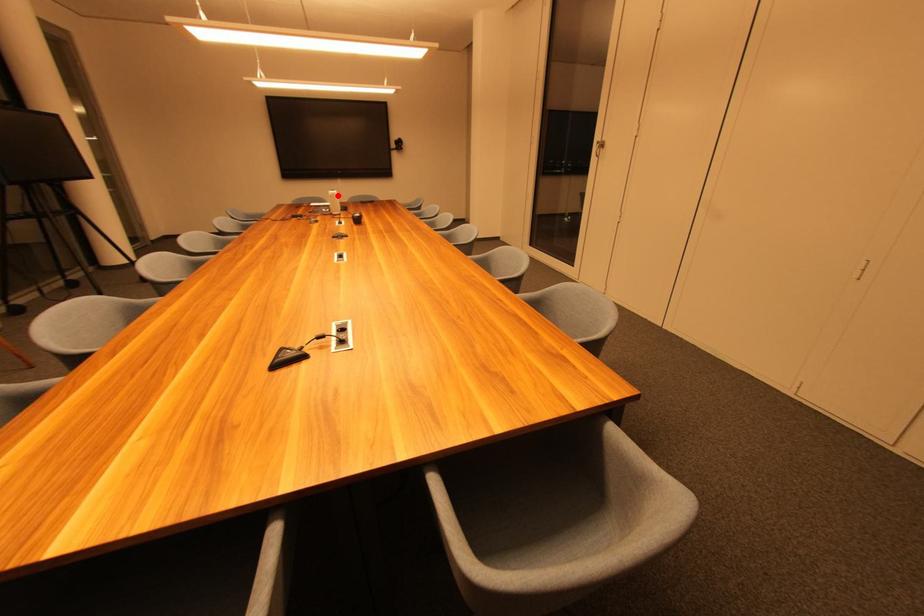
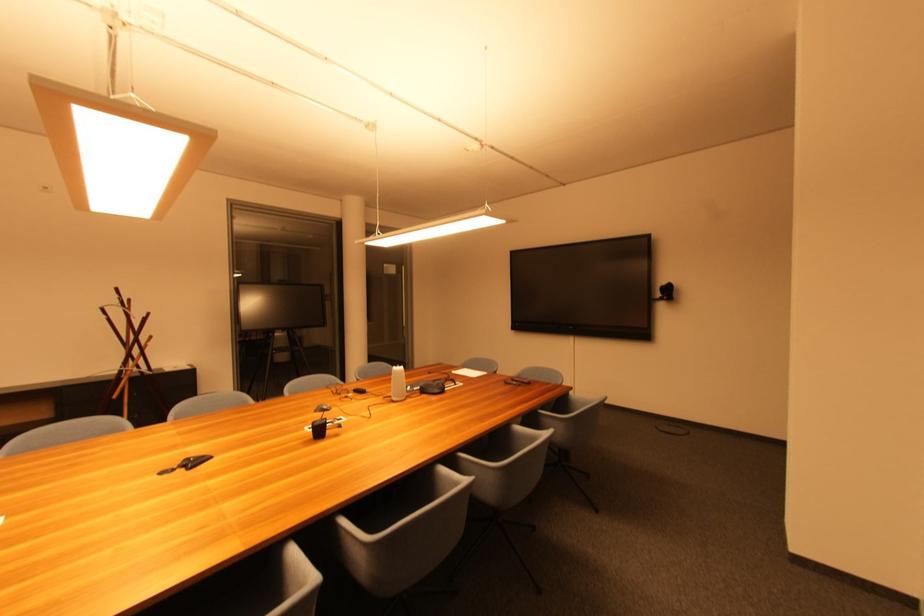
The point at the highlighted location is marked in the first image. Where is the corresponding point in the second image?

(399, 373)